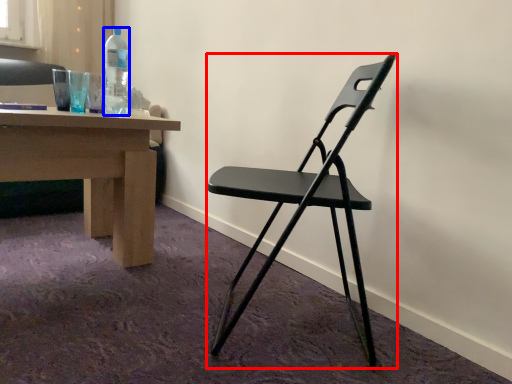
Question: Which of the following is the farthest to the observer, chair (highlighted by a red box) or bottle (highlighted by a blue box)?

Choices:
 (A) chair
 (B) bottle

Answer: (B)